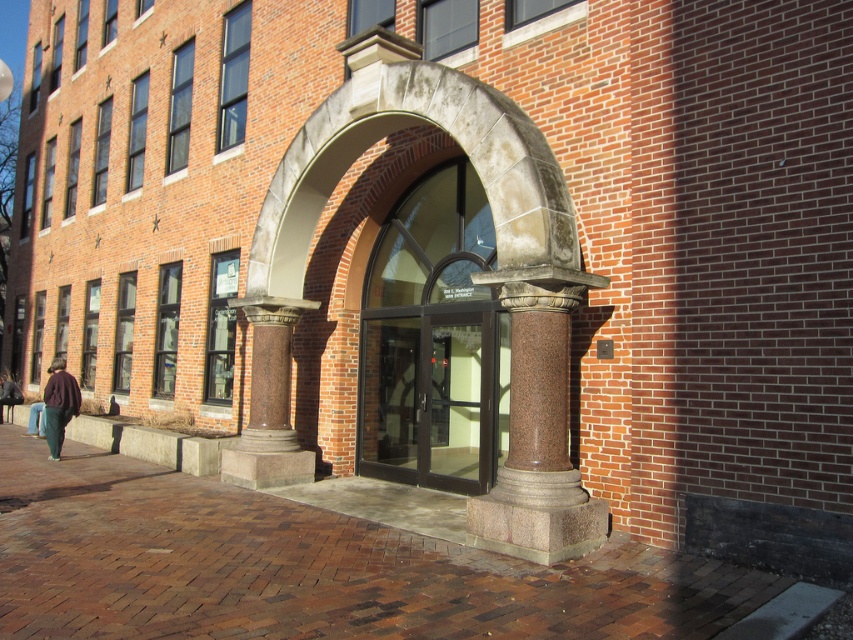
Question: Does clear glass doors at center appear over brown granite column at center?

Choices:
 (A) no
 (B) yes

Answer: (A)

Question: Which point is closer to the camera taking this photo?

Choices:
 (A) (563, 400)
 (B) (294, 460)
 (C) (62, 371)

Answer: (A)

Question: Which object is closer to the camera taking this photo?

Choices:
 (A) brown polished stone column at center
 (B) brown granite column at center
 (C) brick pavement at center

Answer: (C)

Question: Is polished stone archway at center above dark brown sweater at lower left?

Choices:
 (A) yes
 (B) no

Answer: (A)

Question: Is brick pavement at center above dark brown sweater at lower left?

Choices:
 (A) no
 (B) yes

Answer: (A)

Question: Which of the following is the farthest from the observer?

Choices:
 (A) (517, 595)
 (B) (439, 369)
 (C) (9, 397)

Answer: (C)